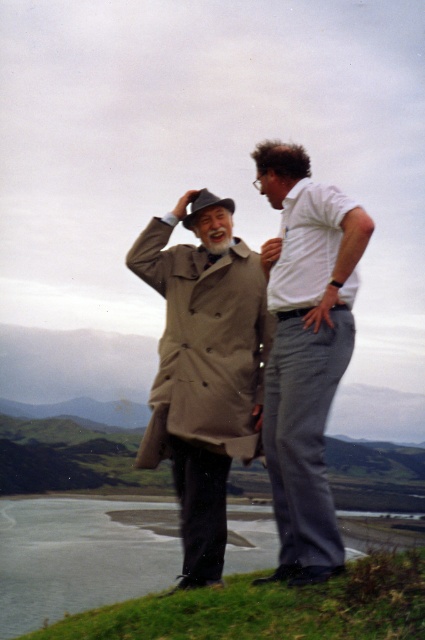
You are a photographer positioned behind the two people in the image. You want to capture a photo where the white cotton shirt at center and beige fabric trench coat at center are both visible. Based on their positions, which clothing item should you place closer to the left side of your camera frame to ensure both are fully visible?

The white cotton shirt at center is to the right of the beige fabric trench coat at center, so to ensure both are fully visible in the frame, you should position the beige fabric trench coat at center closer to the left side of the camera frame.

You are standing on the grassy hillside overlooking the coast and see the beige wool coat at center. If you want to reach it within 10 seconds, what is the minimum speed you need to walk towards it?

The beige wool coat at center is 7.36 meters away. To reach it in 10 seconds, you need to walk at a minimum speed of 0.736 meters per second.